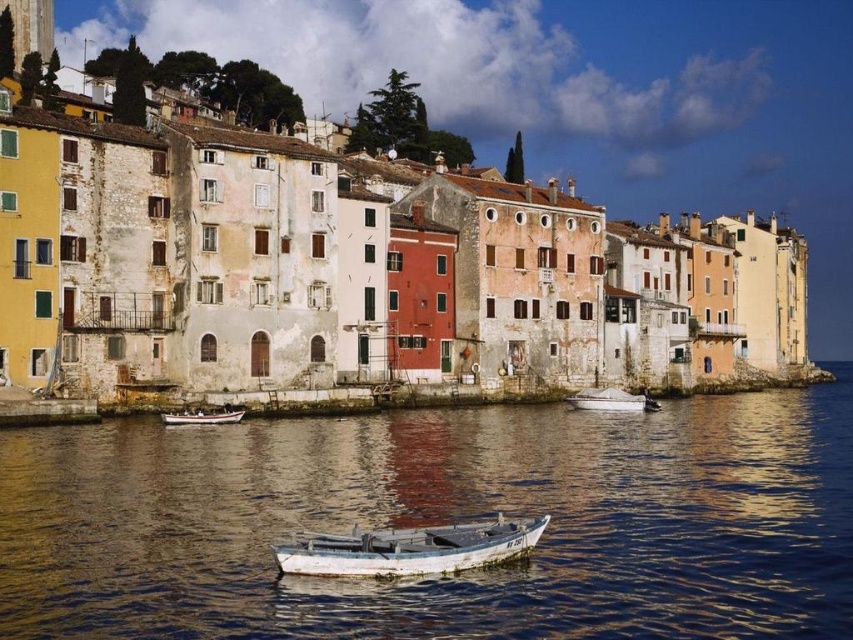
You are a photographer planning to capture the reflection of the buildings in the water. The boat might block the view. Given that the smooth water at center is wider than the white wooden boat at center, can you position yourself so that the boat is entirely within the reflective area of the water?

Yes, since the smooth water at center is wider than the white wooden boat at center, the boat can be positioned entirely within the reflective area of the water.